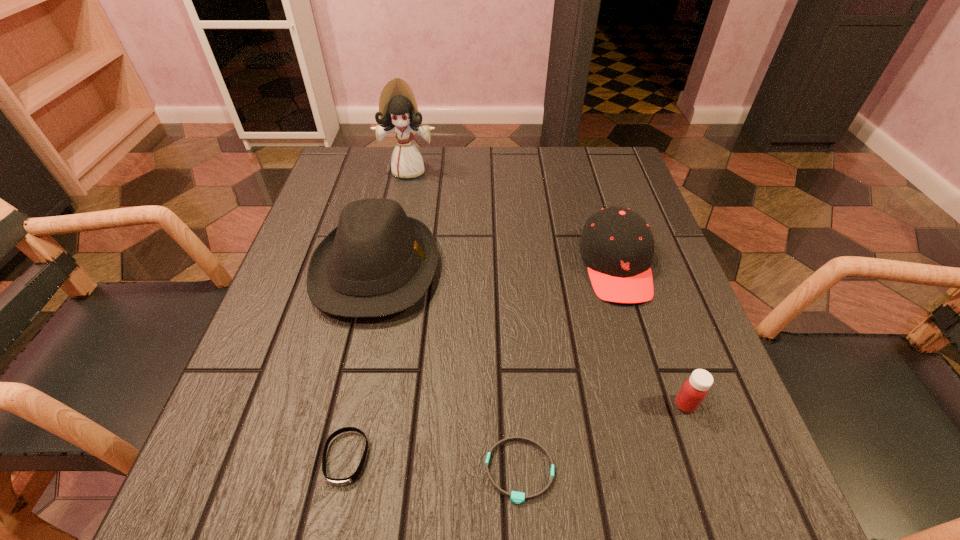
Where is `free space located at the front face of the tallest object`? free space located at the front face of the tallest object is located at coordinates (387, 280).

Where is `vacant region located on the front-facing side of the fedora`? This screenshot has height=540, width=960. vacant region located on the front-facing side of the fedora is located at coordinates (526, 269).

I want to click on vacant space located 0.080m on the front-facing side of the cap, so click(639, 341).

Identify the location of vacant area situated 0.150m on the left of the medicine. (580, 404).

Locate an element on the screen. This screenshot has height=540, width=960. object located in the far edge section of the desktop is located at coordinates (398, 111).

Identify the location of doll positioned at the left edge. Image resolution: width=960 pixels, height=540 pixels. (398, 111).

Where is `fedora present at the left edge`? fedora present at the left edge is located at coordinates (378, 261).

In order to click on cap positioned at the right edge in this screenshot , I will do `click(617, 245)`.

Locate an element on the screen. This screenshot has width=960, height=540. medicine positioned at the right edge is located at coordinates (694, 390).

Identify the location of object located at the far left corner. (398, 111).